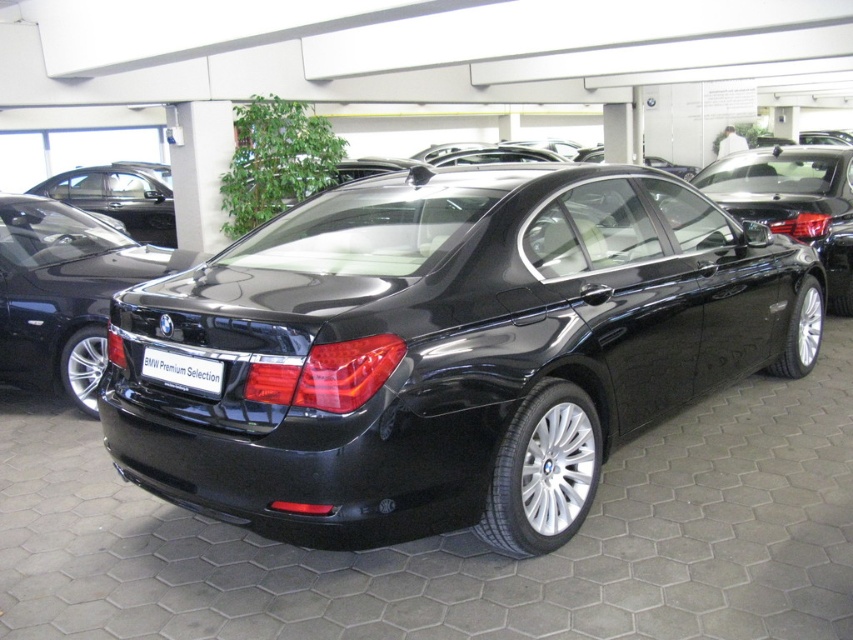
Is matte black sedan at upper left bigger than black plastic license plate at rear?

Indeed, matte black sedan at upper left has a larger size compared to black plastic license plate at rear.

Is matte black sedan at upper left to the left of black plastic license plate at rear from the viewer's perspective?

Yes, matte black sedan at upper left is to the left of black plastic license plate at rear.

Identify the location of matte black sedan at upper left. This screenshot has width=853, height=640. (120, 196).

Who is lower down, matte black car at center or black plastic license plate at rear?

black plastic license plate at rear is lower down.

Does matte black car at center have a lesser width compared to black plastic license plate at rear?

No.

You are a GUI agent. You are given a task and a screenshot of the screen. Output one action in this format:
    pyautogui.click(x=<x>, y=<y>)
    Task: Click on the matte black car at center
    This screenshot has width=853, height=640.
    Given the screenshot: What is the action you would take?
    65,291

Can you confirm if matte black car at center is taller than matte black sedan at upper left?

Correct, matte black car at center is much taller as matte black sedan at upper left.

Does point (19, 243) come closer to viewer compared to point (122, 218)?

Yes, it is.

This screenshot has height=640, width=853. I want to click on matte black car at center, so click(65, 291).